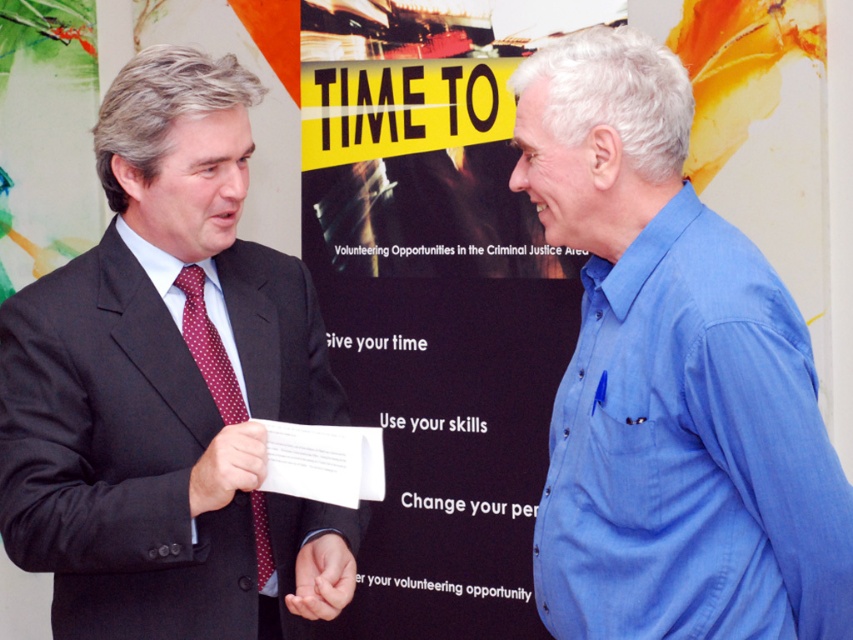
Can you confirm if matte black suit at left is bigger than matte red tie at center?

Yes, matte black suit at left is bigger than matte red tie at center.

Can you confirm if matte black suit at left is positioned below matte red tie at center?

No, matte black suit at left is not below matte red tie at center.

Measure the distance between point (61, 460) and camera.

Point (61, 460) is 5.16 feet from camera.

Where is `matte black suit at left`? The image size is (853, 640). matte black suit at left is located at coordinates (161, 378).

Who is shorter, blue denim shirt at right or smooth skin hand at center?

Standing shorter between the two is smooth skin hand at center.

Measure the distance between point (612, 440) and camera.

Point (612, 440) and camera are 4.76 feet apart.

Locate an element on the screen. The height and width of the screenshot is (640, 853). blue denim shirt at right is located at coordinates (670, 380).

What do you see at coordinates (161, 378) in the screenshot?
I see `matte black suit at left` at bounding box center [161, 378].

Can you confirm if matte black suit at left is bigger than polka dot silk tie at left?

Indeed, matte black suit at left has a larger size compared to polka dot silk tie at left.

Which is behind, point (135, 388) or point (260, 545)?

Positioned behind is point (260, 545).

Locate an element on the screen. The height and width of the screenshot is (640, 853). matte black suit at left is located at coordinates (161, 378).